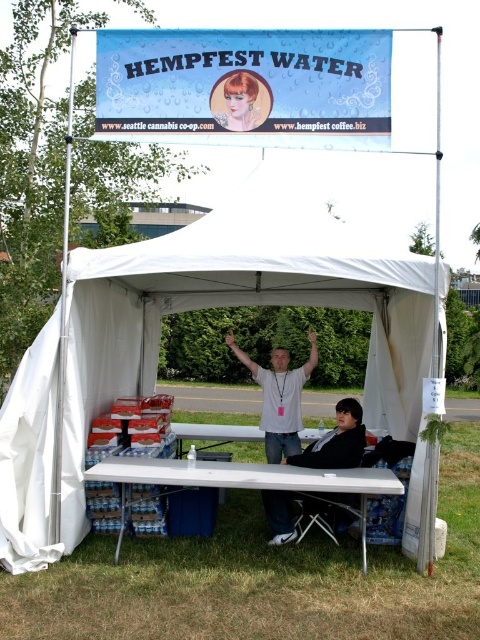
Question: Is white t-shirt at center smaller than smooth plastic face at upper center?

Choices:
 (A) yes
 (B) no

Answer: (B)

Question: Considering the real-world distances, which object is closest to the white t-shirt at center?

Choices:
 (A) black fabric jacket at lower center
 (B) white plastic picnic table at lower center

Answer: (A)

Question: Does white plastic picnic table at lower center have a larger size compared to white t-shirt at center?

Choices:
 (A) no
 (B) yes

Answer: (B)

Question: Which object is positioned farthest from the white plastic picnic table at lower center?

Choices:
 (A) smooth plastic face at upper center
 (B) white t-shirt at center

Answer: (A)

Question: Is white t-shirt at center behind smooth plastic face at upper center?

Choices:
 (A) yes
 (B) no

Answer: (A)

Question: Based on their relative distances, which object is nearer to the white t-shirt at center?

Choices:
 (A) white plastic picnic table at lower center
 (B) smooth plastic face at upper center

Answer: (A)